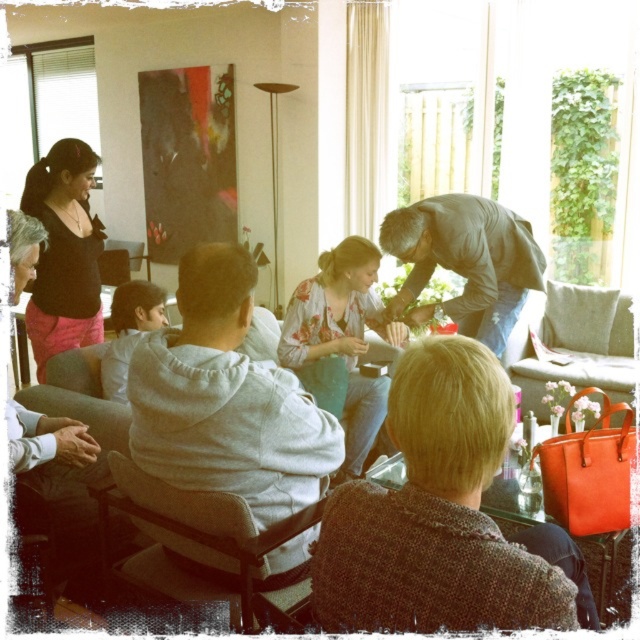
Question: Is gray textured shirt at center bigger than floral-patterned blouse at center?

Choices:
 (A) no
 (B) yes

Answer: (A)

Question: Estimate the real-world distances between objects in this image. Which object is farther from the matte black top at upper left?

Choices:
 (A) gray fleece hoodie at center
 (B) floral-patterned blouse at center
 (C) light gray fabric chair at lower left
 (D) gray textured shirt at center

Answer: (D)

Question: Which of the following is the closest to the observer?

Choices:
 (A) leather handbag at lower right
 (B) gray fleece hoodie at center
 (C) matte black top at upper left

Answer: (A)

Question: Which object is the farthest from the matte black top at upper left?

Choices:
 (A) light gray fabric chair at lower left
 (B) light gray fabric chair at right
 (C) gray fleece hoodie at center
 (D) floral-patterned blouse at center

Answer: (B)

Question: Can you confirm if gray textured shirt at center is wider than light gray fabric chair at lower left?

Choices:
 (A) no
 (B) yes

Answer: (B)

Question: Is leather handbag at lower right closer to camera compared to light gray fabric chair at lower left?

Choices:
 (A) yes
 (B) no

Answer: (A)